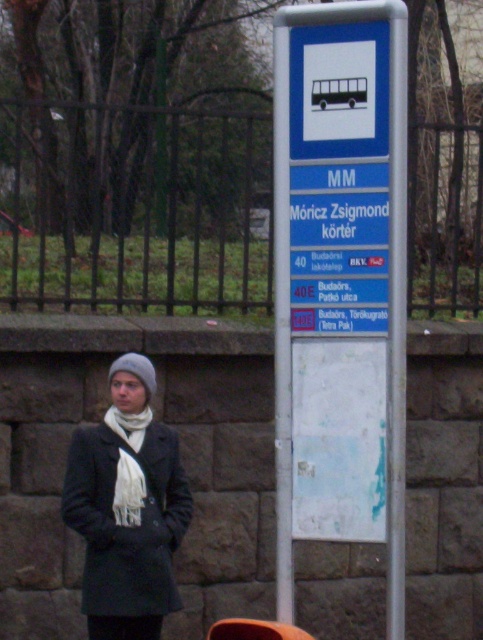
Question: Does blue plastic bus stop sign at center have a smaller size compared to white soft scarf at center?

Choices:
 (A) yes
 (B) no

Answer: (B)

Question: Which of the following is the farthest from the observer?

Choices:
 (A) (129, 417)
 (B) (128, 548)
 (C) (139, 467)
 (D) (292, 317)

Answer: (A)

Question: Which point is closer to the camera taking this photo?

Choices:
 (A) (328, 20)
 (B) (125, 436)
 (C) (79, 452)
 (D) (118, 420)

Answer: (A)

Question: Is blue plastic bus stop sign at center thinner than matte black coat at center?

Choices:
 (A) yes
 (B) no

Answer: (A)

Question: Is the position of blue plastic bus stop sign at center more distant than that of matte black coat at center?

Choices:
 (A) no
 (B) yes

Answer: (A)

Question: Among these objects, which one is farthest from the camera?

Choices:
 (A) blue plastic bus stop sign at center
 (B) matte black coat at center

Answer: (B)